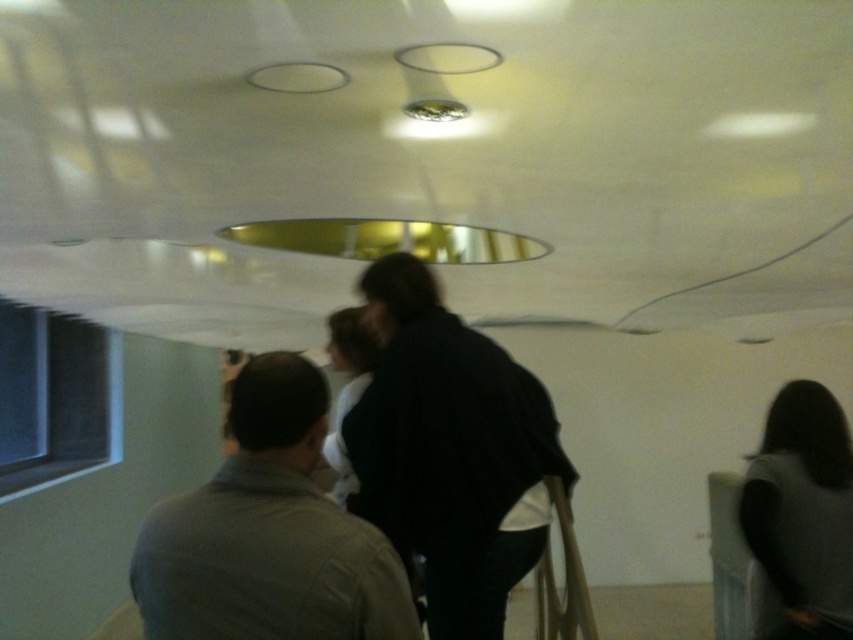
Question: Among these points, which one is nearest to the camera?

Choices:
 (A) [486, 536]
 (B) [819, 464]

Answer: (A)

Question: Is gray cotton shirt at center above dark gray fabric at lower right?

Choices:
 (A) no
 (B) yes

Answer: (B)

Question: Is gray cotton shirt at center below dark gray fabric at lower right?

Choices:
 (A) yes
 (B) no

Answer: (B)

Question: Which object is positioned farthest from the black matte jacket at center?

Choices:
 (A) gray cotton shirt at center
 (B) dark gray fabric at lower right

Answer: (B)

Question: Which point is closer to the camera?

Choices:
 (A) (462, 472)
 (B) (819, 387)
 (C) (242, 602)

Answer: (C)

Question: Can you confirm if black matte jacket at center is positioned to the left of gray cotton shirt at center?

Choices:
 (A) yes
 (B) no

Answer: (B)